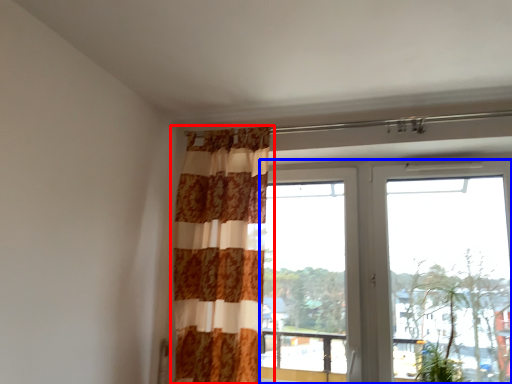
Question: Which of the following is the farthest to the observer, curtain (highlighted by a red box) or window (highlighted by a blue box)?

Choices:
 (A) curtain
 (B) window

Answer: (A)